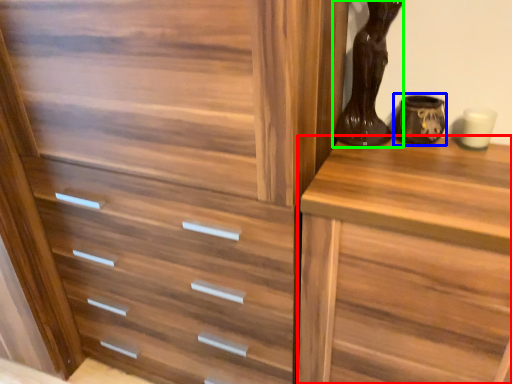
Question: Which object is positioned farthest from chest of drawers (highlighted by a red box)? Select from vase (highlighted by a blue box) and vase (highlighted by a green box).

Choices:
 (A) vase
 (B) vase

Answer: (A)